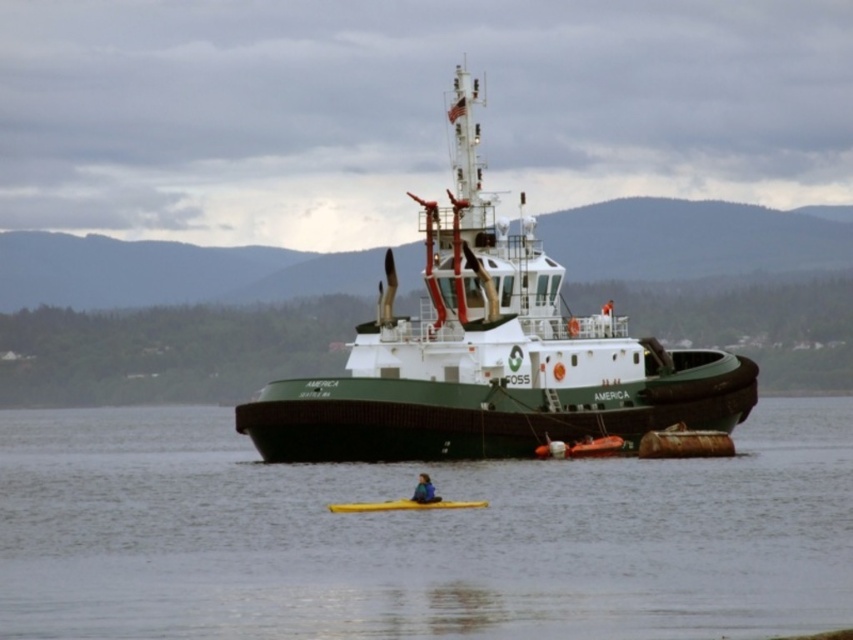
Can you confirm if green matte tugboat at center is shorter than blue fabric kayak at lower center?

In fact, green matte tugboat at center may be taller than blue fabric kayak at lower center.

Is point (361, 435) behind point (415, 488)?

Yes, point (361, 435) is behind point (415, 488).

Locate an element on the screen. Image resolution: width=853 pixels, height=640 pixels. green matte tugboat at center is located at coordinates (489, 355).

Can you confirm if green matte water at center is thinner than blue fabric kayak at lower center?

In fact, green matte water at center might be wider than blue fabric kayak at lower center.

Which of these two, green matte water at center or blue fabric kayak at lower center, stands shorter?

blue fabric kayak at lower center is shorter.

The height and width of the screenshot is (640, 853). Describe the element at coordinates (416, 536) in the screenshot. I see `green matte water at center` at that location.

Image resolution: width=853 pixels, height=640 pixels. What are the coordinates of `green matte water at center` in the screenshot? It's located at (416, 536).

Can you confirm if yellow matte canoe at lower center is positioned below blue fabric kayak at lower center?

Yes.

Between yellow matte canoe at lower center and blue fabric kayak at lower center, which one is positioned higher?

blue fabric kayak at lower center is higher up.

Between point (360, 504) and point (428, 496), which one is positioned behind?

The point (360, 504) is more distant.

At what (x,y) coordinates should I click in order to perform the action: click on yellow matte canoe at lower center. Please return your answer as a coordinate pair (x, y). This screenshot has height=640, width=853. Looking at the image, I should click on (403, 506).